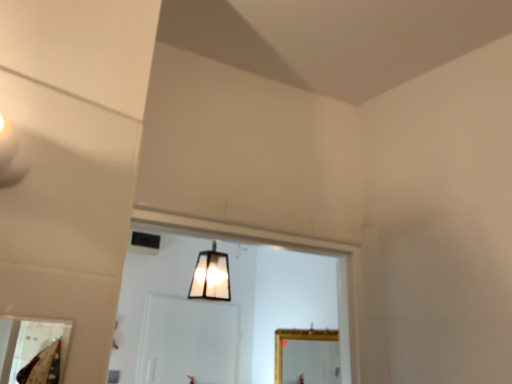
Locate an element on the screen. The image size is (512, 384). gold-framed mirror at center is located at coordinates click(298, 353).

The image size is (512, 384). Describe the element at coordinates (298, 353) in the screenshot. I see `gold-framed mirror at center` at that location.

Image resolution: width=512 pixels, height=384 pixels. Find the location of `gold-framed mirror at center`. gold-framed mirror at center is located at coordinates (298, 353).